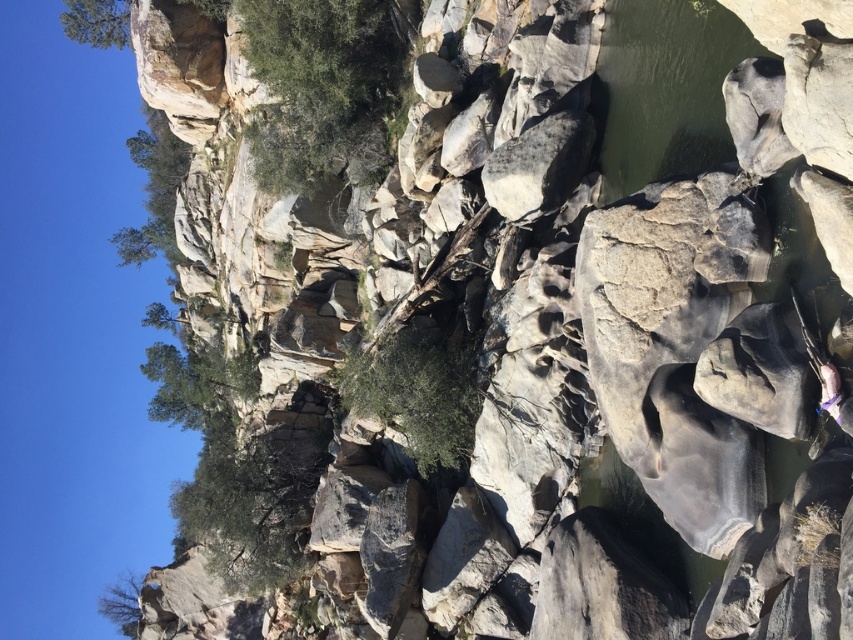
Question: Among these points, which one is nearest to the camera?

Choices:
 (A) (734, 52)
 (B) (111, 589)

Answer: (A)

Question: Does green smooth water at upper right have a larger size compared to green leafy tree at upper left?

Choices:
 (A) no
 (B) yes

Answer: (A)

Question: Based on their relative distances, which object is farther from the green smooth water at upper right?

Choices:
 (A) green leafy tree at lower left
 (B) green leafy tree at upper left

Answer: (A)

Question: Is green smooth water at upper right above green leafy tree at lower left?

Choices:
 (A) no
 (B) yes

Answer: (B)

Question: Which object appears closest to the camera in this image?

Choices:
 (A) green leafy tree at upper left
 (B) green leafy tree at lower left
 (C) green leafy tree at upper center
 (D) green smooth water at upper right

Answer: (D)

Question: Is green smooth water at upper right further to the viewer compared to green leafy tree at lower left?

Choices:
 (A) no
 (B) yes

Answer: (A)